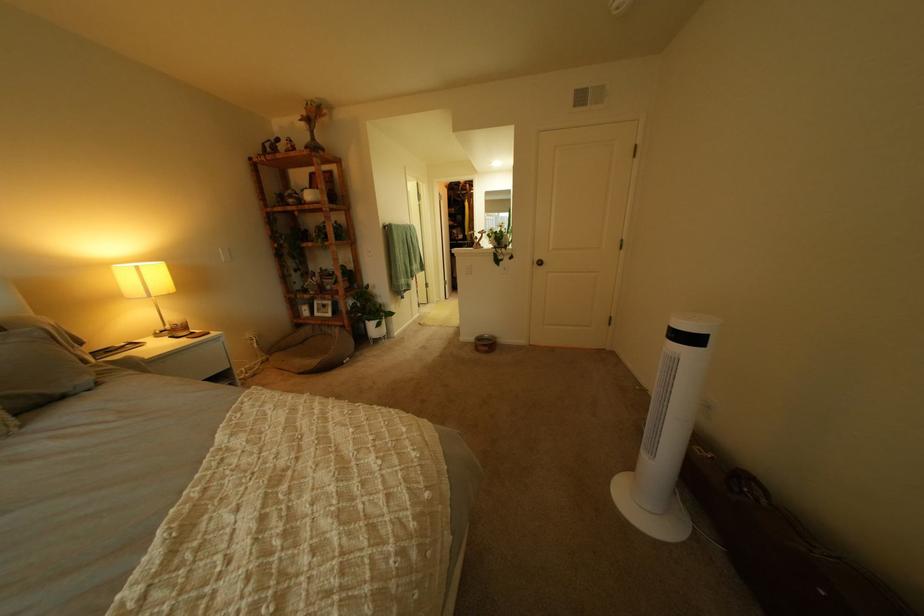
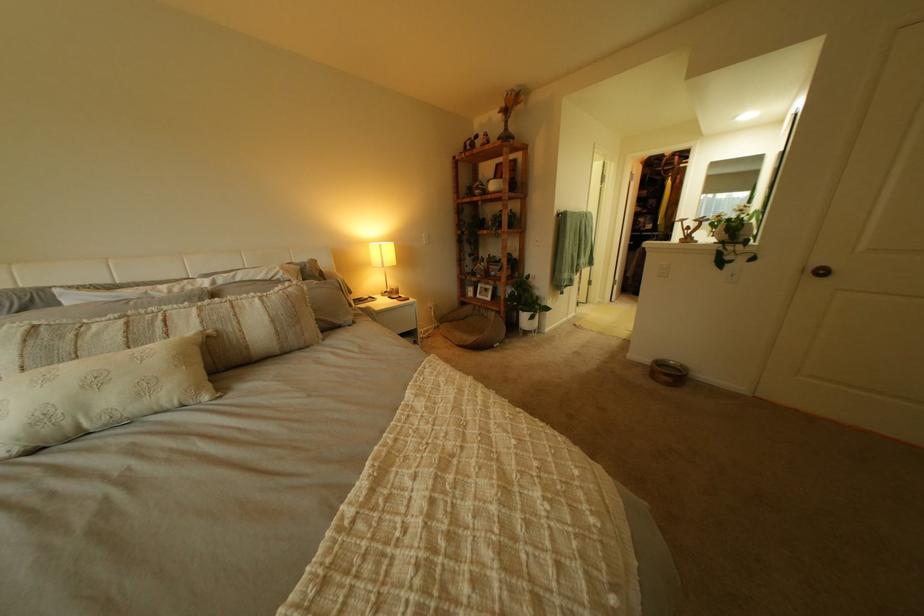
Where in the second image is the point corresponding to the point at 311,195 from the first image?

(497, 185)